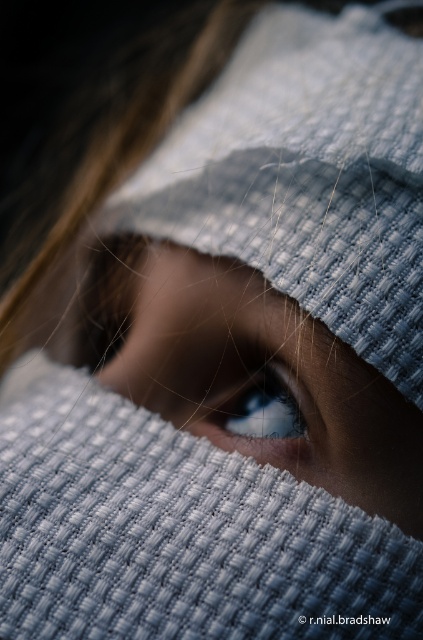
Does blue glossy eye at center lie behind glossy blue eye at center?

No.

Can you confirm if blue glossy eye at center is wider than glossy blue eye at center?

Yes.

The height and width of the screenshot is (640, 423). Find the location of `blue glossy eye at center`. blue glossy eye at center is located at coordinates (249, 372).